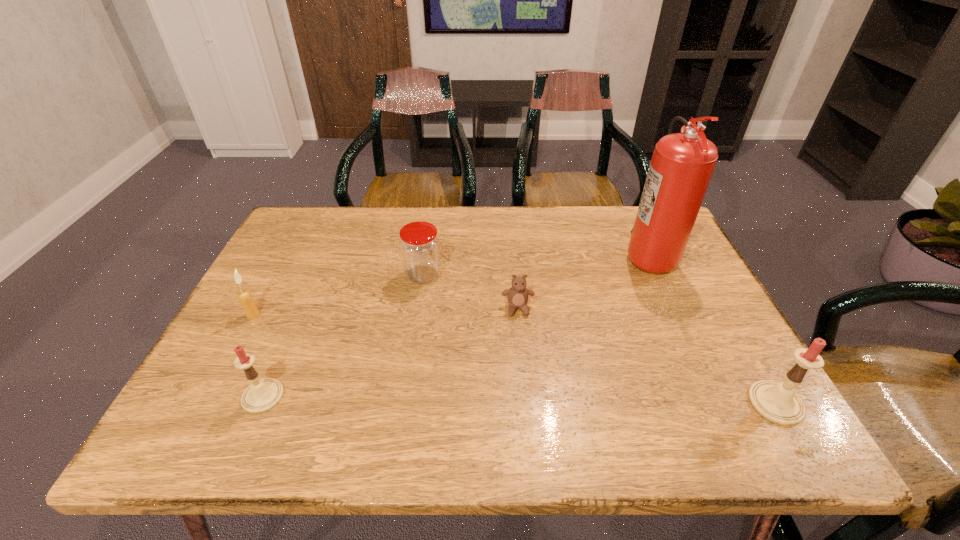
Where is `free spot between the third object from right to left and the fire extinguisher`? The image size is (960, 540). free spot between the third object from right to left and the fire extinguisher is located at coordinates (583, 281).

What are the coordinates of `free spot between the second object from left to right and the jar` in the screenshot? It's located at (343, 336).

This screenshot has width=960, height=540. I want to click on free space between the fourth object from right to left and the leftmost candle, so pos(338,295).

In order to click on vacant area that lies between the second candle from left to right and the jar in this screenshot , I will do `click(343, 336)`.

This screenshot has height=540, width=960. What are the coordinates of `empty space between the second candle from right to left and the rightmost candle` in the screenshot? It's located at (519, 400).

Find the location of a particular element. free space between the leftmost candle and the third object from left to right is located at coordinates (338, 295).

At what (x,y) coordinates should I click in order to perform the action: click on the second closest object to the tallest object. Please return your answer as a coordinate pair (x, y). The width and height of the screenshot is (960, 540). Looking at the image, I should click on (777, 402).

This screenshot has height=540, width=960. Find the location of `object that stands as the second closest to the leftmost candle`. object that stands as the second closest to the leftmost candle is located at coordinates click(419, 245).

Point out which candle is positioned as the nearest to the second candle from left to right. Please provide its 2D coordinates. Your answer should be formatted as a tuple, i.e. [(x, y)], where the tuple contains the x and y coordinates of a point satisfying the conditions above.

[(244, 296)]

Select which candle appears as the second closest to the rightmost candle. Please provide its 2D coordinates. Your answer should be formatted as a tuple, i.e. [(x, y)], where the tuple contains the x and y coordinates of a point satisfying the conditions above.

[(244, 296)]